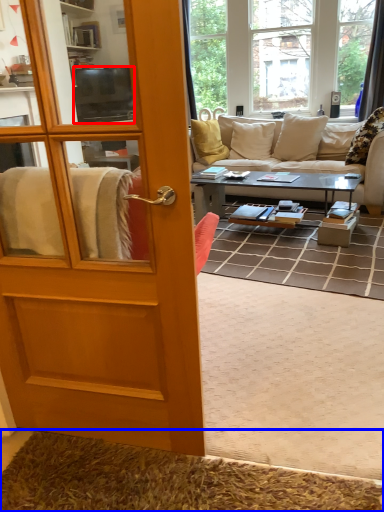
Question: Among these objects, which one is nearest to the camera, television (highlighted by a red box) or doormat (highlighted by a blue box)?

Choices:
 (A) television
 (B) doormat

Answer: (B)